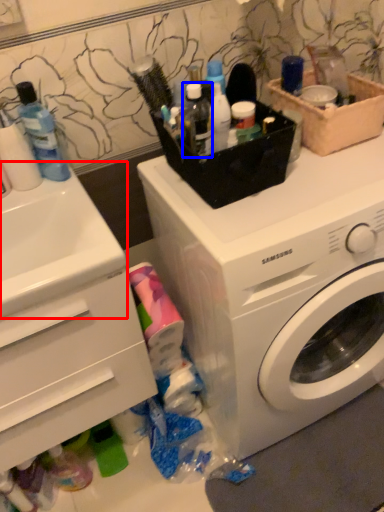
Question: Among these objects, which one is farthest to the camera, sink (highlighted by a red box) or toiletry (highlighted by a blue box)?

Choices:
 (A) sink
 (B) toiletry

Answer: (B)